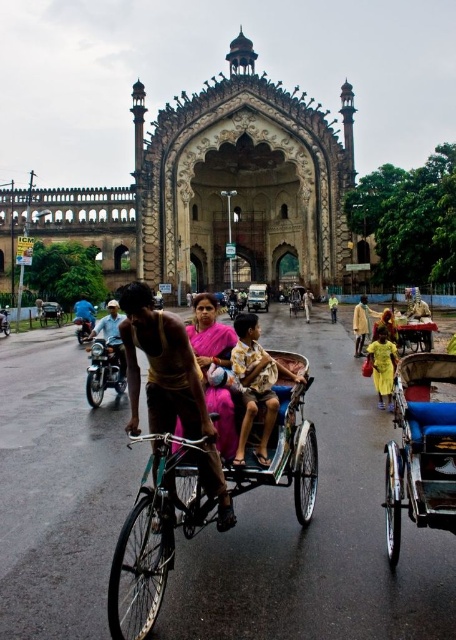
Does shiny gold bicycle at center have a larger size compared to brushed metal motorcycle at center?

Yes, shiny gold bicycle at center is bigger than brushed metal motorcycle at center.

Can you confirm if shiny gold bicycle at center is positioned below brushed metal motorcycle at center?

Indeed, shiny gold bicycle at center is positioned under brushed metal motorcycle at center.

Where is `shiny gold bicycle at center`? Image resolution: width=456 pixels, height=640 pixels. shiny gold bicycle at center is located at coordinates (171, 387).

Locate an element on the screen. shiny gold bicycle at center is located at coordinates (171, 387).

Who is lower down, yellow fabric dress at center or wooden cart at center?

Positioned lower is yellow fabric dress at center.

Measure the distance between yellow fabric dress at center and wooden cart at center.

yellow fabric dress at center is 6.97 meters from wooden cart at center.

Is point (378, 396) behind point (413, 339)?

No, it is in front of (413, 339).

Image resolution: width=456 pixels, height=640 pixels. In order to click on yellow fabric dress at center in this screenshot , I will do `click(383, 365)`.

Can you confirm if yellow fabric dress at center is positioned below brushed metal motorcycle at center?

Correct, yellow fabric dress at center is located below brushed metal motorcycle at center.

Which is above, yellow fabric dress at center or brushed metal motorcycle at center?

brushed metal motorcycle at center is higher up.

Between point (377, 333) and point (82, 314), which one is positioned in front?

Positioned in front is point (377, 333).

Identify the location of yellow fabric dress at center. (383, 365).